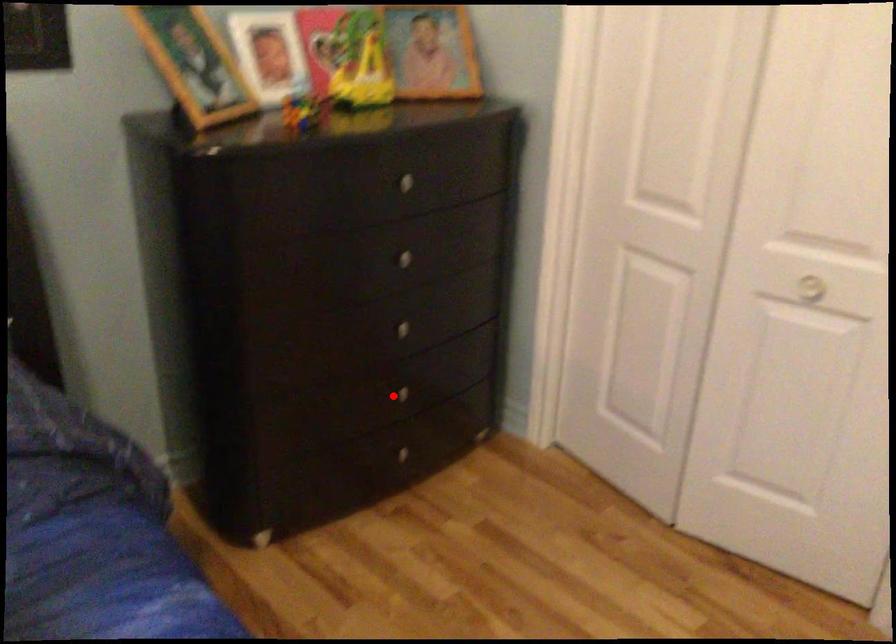
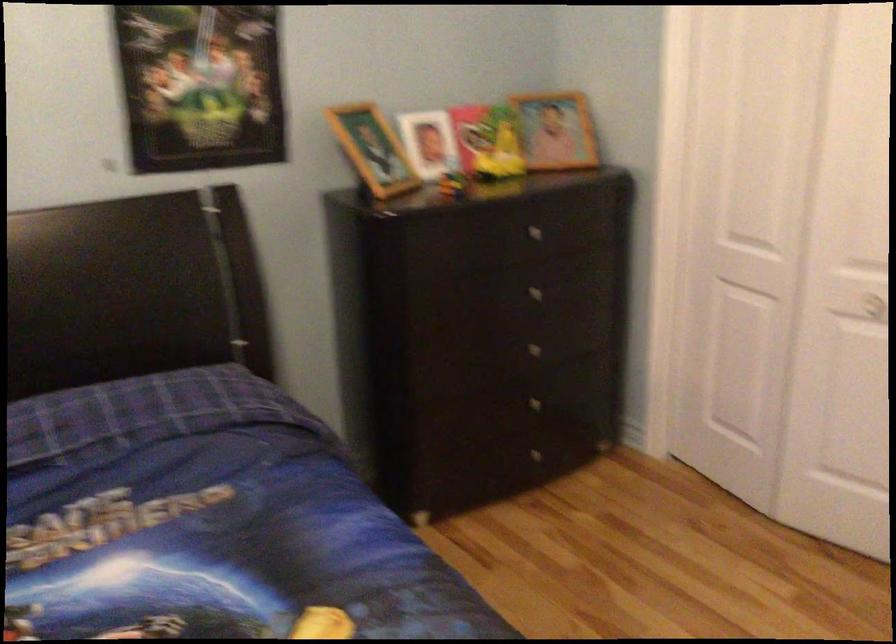
The point at the highlighted location is marked in the first image. Where is the corresponding point in the second image?

(528, 406)